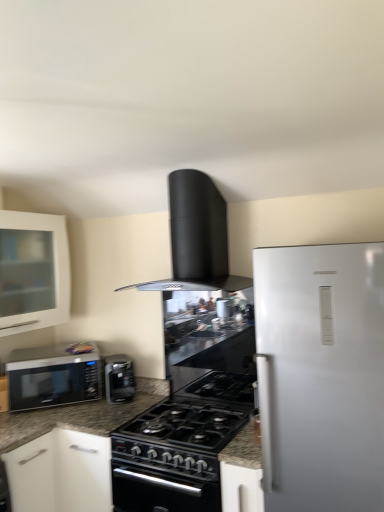
What are the coordinates of `satin black coffee maker at center` in the screenshot? It's located at (119, 379).

The image size is (384, 512). What do you see at coordinates (33, 271) in the screenshot?
I see `white glass cabinet at left` at bounding box center [33, 271].

This screenshot has height=512, width=384. Identify the location of black matte gas stove at center. (188, 428).

Locate an element on the screen. black matte range hood at upper center is located at coordinates (x=197, y=237).

Image resolution: width=384 pixels, height=512 pixels. In order to click on home appliance above the black matte gas stove at center (from a real-world perspective) in this screenshot , I will do `click(197, 237)`.

Is black matte gas stove at center turned away from black matte range hood at upper center?

No, black matte range hood at upper center is not at the back of black matte gas stove at center.

How much distance is there between black matte gas stove at center and black matte range hood at upper center?

They are 75.85 centimeters apart.

In the scene shown: Is black matte gas stove at center not inside black matte range hood at upper center?

Absolutely, black matte gas stove at center is external to black matte range hood at upper center.

Consider the image. What's the angular difference between black matte range hood at upper center and black matte gas stove at center's facing directions?

0.000145 degrees separate the facing orientations of black matte range hood at upper center and black matte gas stove at center.

Is black matte range hood at upper center facing towards black matte gas stove at center?

No.

In the scene shown: Between black matte range hood at upper center and black matte gas stove at center, which one has smaller width?

With smaller width is black matte range hood at upper center.

Is black matte range hood at upper center to the left or to the right of black matte gas stove at center in the image?

From the image, it's evident that black matte range hood at upper center is to the left of black matte gas stove at center.

Measure the distance between satin black coffee maker at center and black matte range hood at upper center.

A distance of 84.93 centimeters exists between satin black coffee maker at center and black matte range hood at upper center.

Could you tell me if satin black coffee maker at center is facing black matte range hood at upper center?

No, satin black coffee maker at center does not turn towards black matte range hood at upper center.

Between satin black coffee maker at center and black matte range hood at upper center, which one has less height?

Standing shorter between the two is satin black coffee maker at center.

Is satin black coffee maker at center not within black matte range hood at upper center?

Indeed, satin black coffee maker at center is completely outside black matte range hood at upper center.

Is black matte gas stove at center next to satin black microwave at left?

black matte gas stove at center and satin black microwave at left are clearly separated.

Is black matte gas stove at center taller or shorter than satin black microwave at left?

black matte gas stove at center is shorter than satin black microwave at left.

In the image, is black matte gas stove at center on the left side or the right side of satin black microwave at left?

From the image, it's evident that black matte gas stove at center is to the right of satin black microwave at left.

Is point (178, 423) farther from camera compared to point (77, 355)?

That is False.

Where is `kitchen appliance beneath the satin black microwave at left (from a real-world perspective)`? The image size is (384, 512). kitchen appliance beneath the satin black microwave at left (from a real-world perspective) is located at coordinates (119, 379).

Considering the positions of objects satin black coffee maker at center and satin black microwave at left in the image provided, who is more to the left, satin black coffee maker at center or satin black microwave at left?

satin black microwave at left is more to the left.

Is satin black coffee maker at center far away from satin black microwave at left?

No, satin black coffee maker at center is not far away from satin black microwave at left.

Considering the relative sizes of satin black coffee maker at center and satin black microwave at left in the image provided, is satin black coffee maker at center thinner than satin black microwave at left?

Yes, satin black coffee maker at center is thinner than satin black microwave at left.

In terms of width, does black matte gas stove at center look wider or thinner when compared to white glass cabinet at left?

Considering their sizes, black matte gas stove at center looks broader than white glass cabinet at left.

Between point (226, 441) and point (39, 245), which one is positioned in front?

Point (226, 441)

Between black matte gas stove at center and white glass cabinet at left, which one is positioned behind?

white glass cabinet at left is further away from the camera.

In terms of size, does black matte gas stove at center appear bigger or smaller than white glass cabinet at left?

Considering their sizes, black matte gas stove at center takes up less space than white glass cabinet at left.

Who is shorter, satin black microwave at left or black matte gas stove at center?

Standing shorter between the two is black matte gas stove at center.

From the image's perspective, between satin black microwave at left and black matte gas stove at center, which one is located above?

From the image's view, satin black microwave at left is above.

Looking at this image, could black matte gas stove at center be considered to be inside satin black microwave at left?

That's incorrect, black matte gas stove at center is not inside satin black microwave at left.

Does satin black microwave at left have a greater width compared to black matte gas stove at center?

No.

Where is `home appliance above the black matte gas stove at center (from a real-world perspective)`? This screenshot has height=512, width=384. home appliance above the black matte gas stove at center (from a real-world perspective) is located at coordinates (197, 237).

Identify the location of gas stove on the right of black matte range hood at upper center. The height and width of the screenshot is (512, 384). (188, 428).

Which object lies nearer to the anchor point satin black coffee maker at center, black matte gas stove at center or white glass cabinet at left?

black matte gas stove at center is closer to satin black coffee maker at center.

Considering their positions, is black matte gas stove at center positioned further to satin black microwave at left than black matte range hood at upper center?

Among the two, black matte range hood at upper center is located further to satin black microwave at left.

Estimate the real-world distances between objects in this image. Which object is closer to satin black microwave at left, black matte range hood at upper center or white glass cabinet at left?

white glass cabinet at left.

Looking at the image, which one is located closer to black matte range hood at upper center, black matte gas stove at center or satin black coffee maker at center?

black matte gas stove at center is positioned closer to the anchor black matte range hood at upper center.

Looking at the image, which one is located further to white glass cabinet at left, satin black microwave at left or black matte gas stove at center?

Based on the image, black matte gas stove at center appears to be further to white glass cabinet at left.

Looking at the image, which one is located further to white glass cabinet at left, satin black microwave at left or satin black coffee maker at center?

satin black coffee maker at center lies further to white glass cabinet at left than the other object.

When comparing their distances from satin black microwave at left, does satin black coffee maker at center or white glass cabinet at left seem further?

Based on the image, white glass cabinet at left appears to be further to satin black microwave at left.

Considering their positions, is black matte range hood at upper center positioned closer to white glass cabinet at left than satin black microwave at left?

satin black microwave at left.

The height and width of the screenshot is (512, 384). In order to click on microwave oven between black matte range hood at upper center and black matte gas stove at center in the up-down direction in this screenshot , I will do `click(53, 375)`.

Locate an element on the screen. This screenshot has height=512, width=384. kitchen appliance located between white glass cabinet at left and black matte gas stove at center in the left-right direction is located at coordinates (119, 379).

Where is `microwave oven between white glass cabinet at left and satin black coffee maker at center from top to bottom`? This screenshot has width=384, height=512. microwave oven between white glass cabinet at left and satin black coffee maker at center from top to bottom is located at coordinates (53, 375).

Find the location of a particular element. Image resolution: width=384 pixels, height=512 pixels. kitchen appliance located between satin black microwave at left and black matte gas stove at center in the left-right direction is located at coordinates (119, 379).